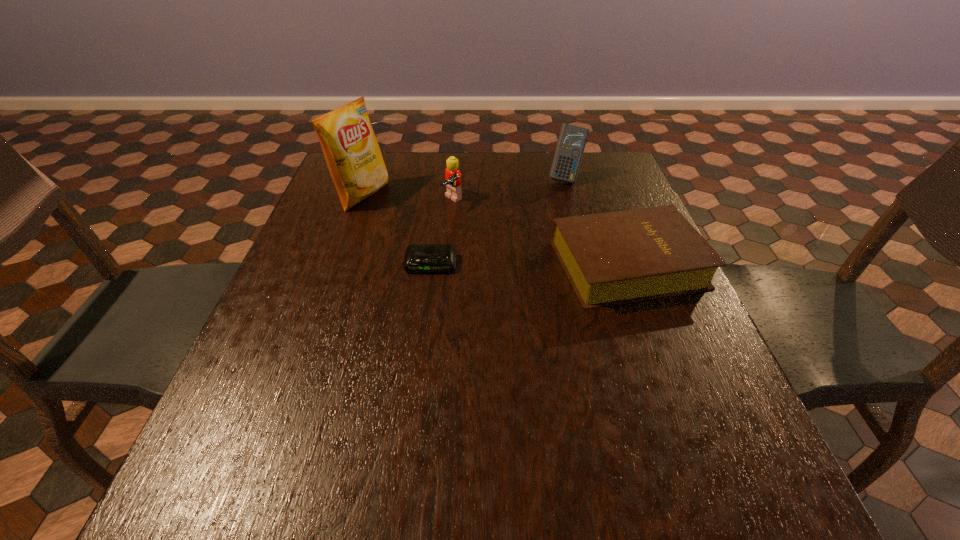
Locate an element on the screen. The width and height of the screenshot is (960, 540). vacant space located on the front-facing side of the leftmost object is located at coordinates (473, 240).

At what (x,y) coordinates should I click in order to perform the action: click on free space located 0.240m on the front-facing side of the calculator. Please return your answer as a coordinate pair (x, y). Looking at the image, I should click on (557, 235).

Locate an element on the screen. Image resolution: width=960 pixels, height=540 pixels. vacant space positioned 0.360m on the front-facing side of the calculator is located at coordinates (553, 266).

You are a GUI agent. You are given a task and a screenshot of the screen. Output one action in this format:
    pyautogui.click(x=<x>, y=<y>)
    Task: Click on the vacant space located 0.190m on the front-facing side of the calculator
    
    Given the screenshot: What is the action you would take?
    pyautogui.click(x=559, y=224)

Locate an element on the screen. Image resolution: width=960 pixels, height=540 pixels. vacant space positioned in front of the third tallest object with the accessory visible is located at coordinates click(552, 269).

Locate an element on the screen. vacant point located in front of the third tallest object with the accessory visible is located at coordinates (541, 263).

Where is `vacant space situated 0.160m in front of the third tallest object with the accessory visible`? The image size is (960, 540). vacant space situated 0.160m in front of the third tallest object with the accessory visible is located at coordinates (500, 236).

Where is `crisp (potato chip) that is positioned at the far edge`? The image size is (960, 540). crisp (potato chip) that is positioned at the far edge is located at coordinates (353, 156).

Where is `calculator positioned at the far edge`? Image resolution: width=960 pixels, height=540 pixels. calculator positioned at the far edge is located at coordinates (572, 139).

Locate an element on the screen. The width and height of the screenshot is (960, 540). Lego that is at the far edge is located at coordinates (453, 182).